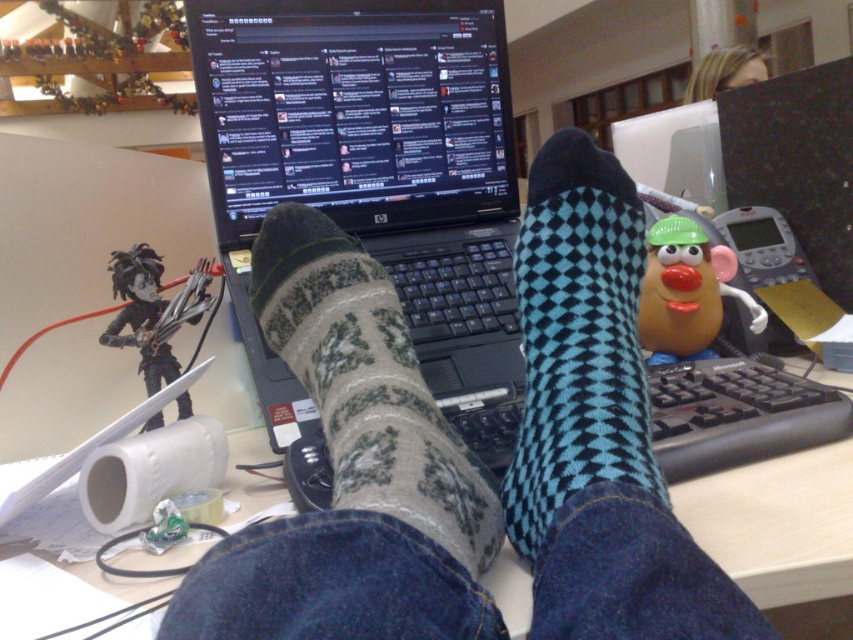
Is black glossy laptop at center taller than black matte figure at center?

Yes.

Is point (293, 88) positioned behind point (157, 388)?

Yes, point (293, 88) is behind point (157, 388).

Where is `black glossy laptop at center`? This screenshot has height=640, width=853. black glossy laptop at center is located at coordinates (354, 112).

Can you confirm if black plastic keyboard at center is bigger than rubber nose at center?

Yes.

Between point (721, 445) and point (664, 282), which one is positioned in front?

Point (721, 445) is in front.

Identify the location of black plastic keyboard at center. (737, 413).

Can you confirm if green fabric mr potato head at right is positioned to the left of blonde hair at upper center?

Yes, green fabric mr potato head at right is to the left of blonde hair at upper center.

Describe the element at coordinates (686, 291) in the screenshot. I see `green fabric mr potato head at right` at that location.

This screenshot has height=640, width=853. I want to click on green fabric mr potato head at right, so click(686, 291).